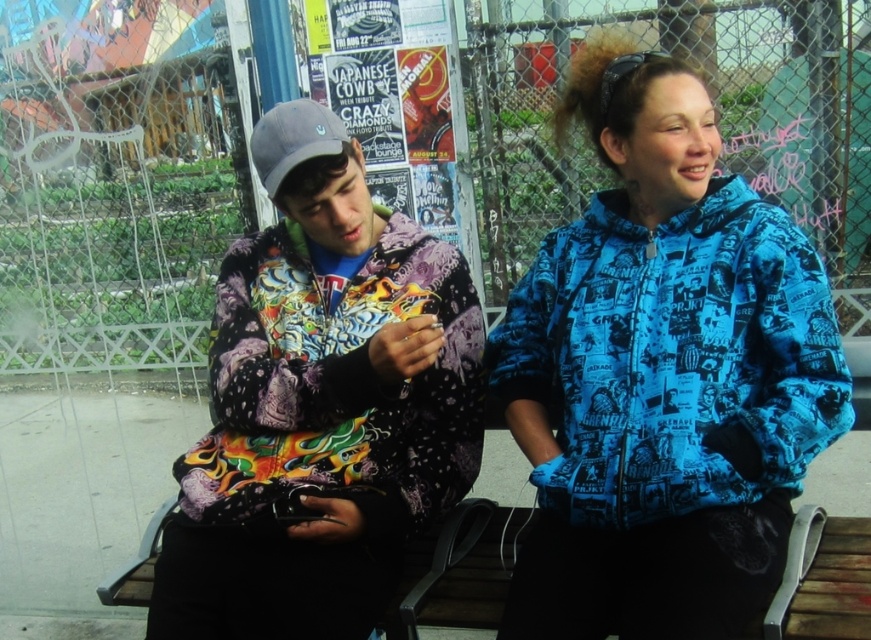
Between printed fabric hoodie at left and blue printed jacket at upper right, which one appears on the left side from the viewer's perspective?

Positioned to the left is printed fabric hoodie at left.

Where is `printed fabric hoodie at left`? This screenshot has width=871, height=640. printed fabric hoodie at left is located at coordinates (321, 404).